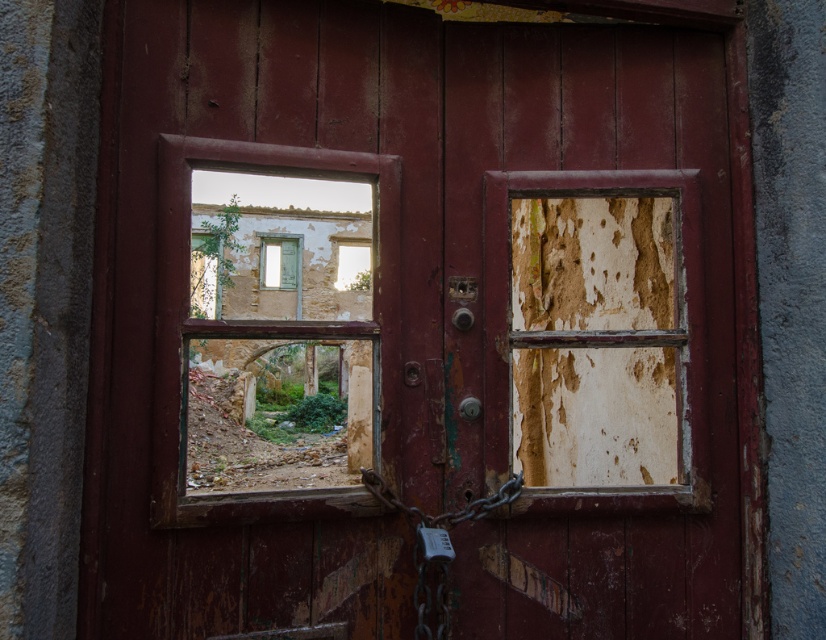
Can you confirm if wooden window at center is positioned below rusty metal chain at center?

No.

Measure the distance between wooden window at center and rusty metal chain at center.

A distance of 3.19 meters exists between wooden window at center and rusty metal chain at center.

The image size is (826, 640). Find the location of `wooden window at center`. wooden window at center is located at coordinates (267, 332).

Locate an element on the screen. wooden window at center is located at coordinates (267, 332).

Which is below, wooden window at center or cracked glass window at upper center?

wooden window at center

Is wooden window at center further to camera compared to cracked glass window at upper center?

No, it is in front of cracked glass window at upper center.

Identify the location of wooden window at center. (267, 332).

Where is `wooden window at center`? wooden window at center is located at coordinates (267, 332).

Is point (181, 362) farther from camera compared to point (554, 404)?

No, (181, 362) is closer to viewer.

Does wooden window at center appear on the right side of peeling paint window at center?

In fact, wooden window at center is to the left of peeling paint window at center.

Image resolution: width=826 pixels, height=640 pixels. Identify the location of wooden window at center. (267, 332).